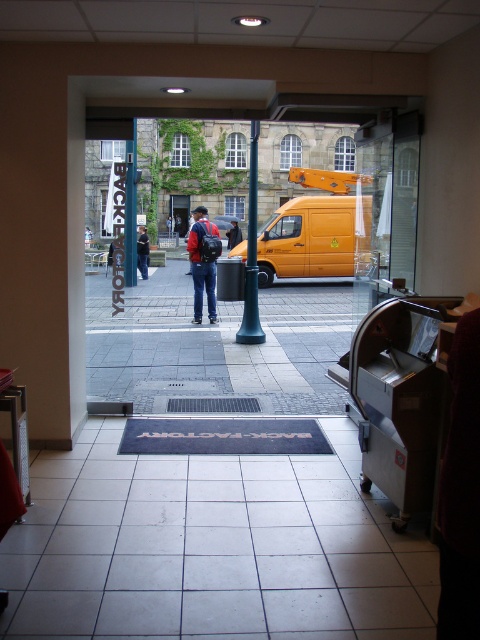
You are a delivery person trying to park your 2.5 meter wide truck. The white tile pavement at center and gray tile pavement at center are both potential parking spots. Based on their widths, which pavement would be suitable for parking your truck?

The gray tile pavement at center has a greater width than the white tile pavement at center. Since your truck is 2.5 meters wide, the gray tile pavement at center would be suitable for parking as it can accommodate the truck width.

You are standing in the corridor and see the green polished metal pole at center and the red backpack at center. Which object is higher from the ground?

The green polished metal pole at center is above the red backpack at center, so it is higher from the ground.

You are a delivery person who needs to park your van on the white tile pavement at center. However, there is a green polished metal pole at center above it. Will the pole interfere with parking your van there?

The white tile pavement at center is positioned under the green polished metal pole at center, so the pole may interfere with parking the van there as it is directly above the parking area.